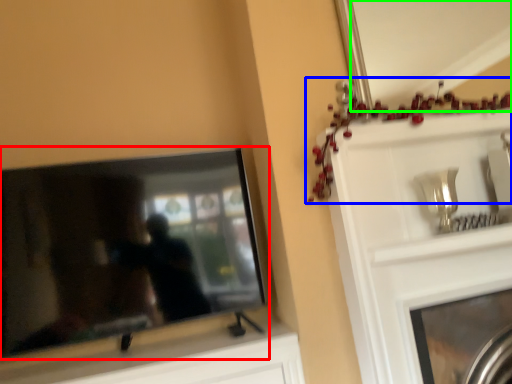
Question: Based on their relative distances, which object is farther from television (highlighted by a red box)? Choose from christmas decoration (highlighted by a blue box) and mirror (highlighted by a green box).

Choices:
 (A) christmas decoration
 (B) mirror

Answer: (B)